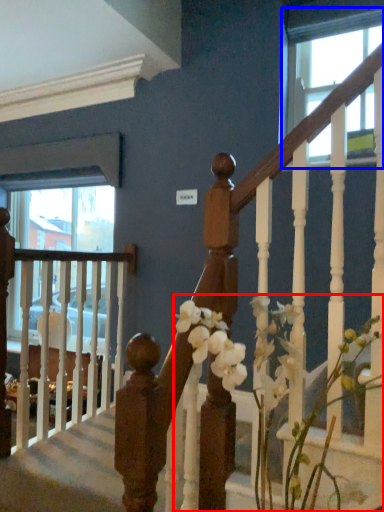
Question: Which object is closer to the camera taking this photo, floral arrangement (highlighted by a red box) or window (highlighted by a blue box)?

Choices:
 (A) floral arrangement
 (B) window

Answer: (A)